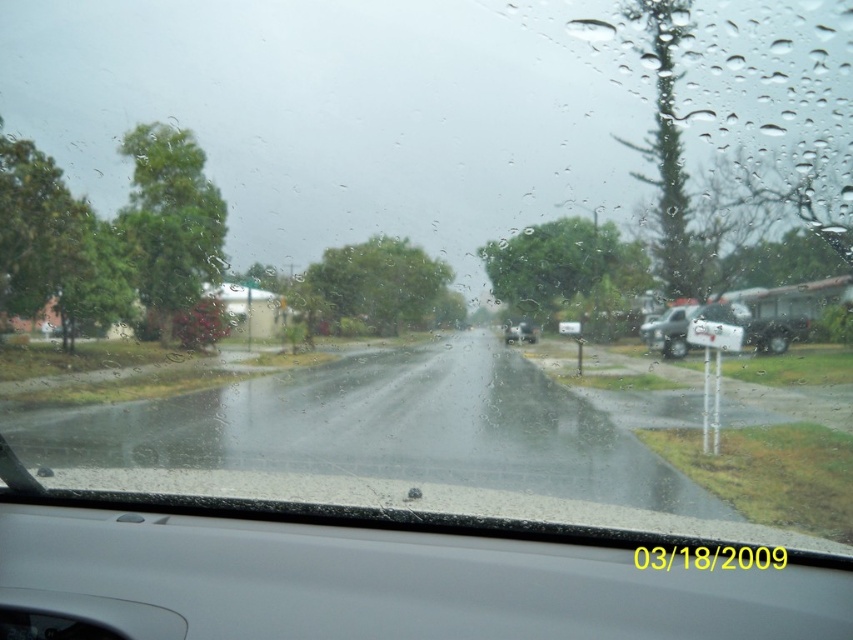
Question: Is white matte truck at right positioned at the back of metallic silver sedan at center?

Choices:
 (A) no
 (B) yes

Answer: (A)

Question: Which object is positioned closest to the gray matte dashboard at center?

Choices:
 (A) metallic silver sedan at center
 (B) white matte truck at right

Answer: (B)

Question: Is gray matte dashboard at center above metallic silver sedan at center?

Choices:
 (A) no
 (B) yes

Answer: (A)

Question: Is gray matte dashboard at center to the left of metallic silver sedan at center from the viewer's perspective?

Choices:
 (A) no
 (B) yes

Answer: (B)

Question: Among these points, which one is farthest from the camera?

Choices:
 (A) (537, 337)
 (B) (686, 317)
 (C) (850, 624)

Answer: (A)

Question: Which object is farther from the camera taking this photo?

Choices:
 (A) white matte truck at right
 (B) gray matte dashboard at center
 (C) metallic silver sedan at center

Answer: (C)